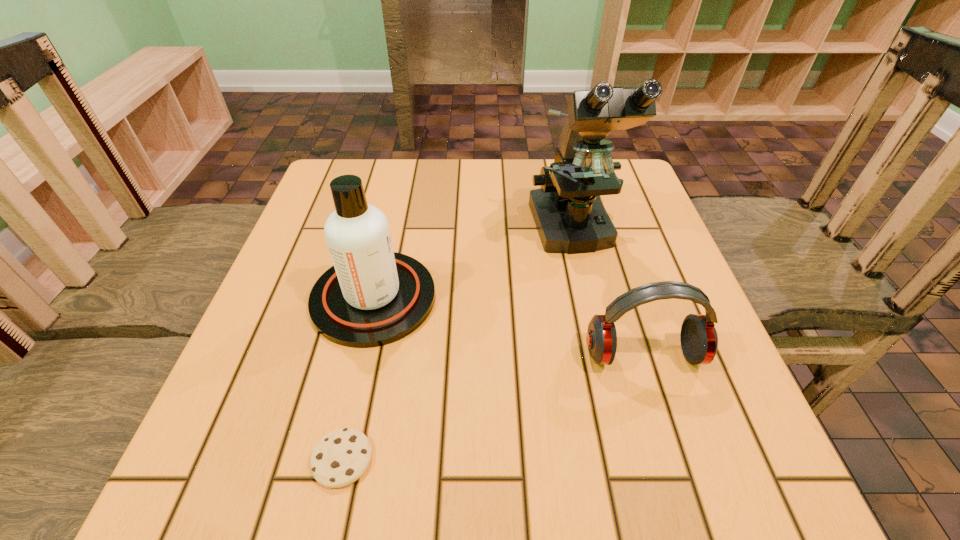
At what (x,y) coordinates should I click in order to perform the action: click on microscope. Please return your answer as a coordinate pair (x, y). The width and height of the screenshot is (960, 540). Looking at the image, I should click on (570, 218).

Image resolution: width=960 pixels, height=540 pixels. I want to click on the second tallest object, so click(372, 296).

At what (x,y) coordinates should I click in order to perform the action: click on the second shortest object. Please return your answer as a coordinate pair (x, y). Looking at the image, I should click on 699,341.

Locate an element on the screen. This screenshot has width=960, height=540. the nearest object is located at coordinates (341, 457).

Find the location of a particular element. This screenshot has height=540, width=960. the shortest object is located at coordinates (341, 457).

The height and width of the screenshot is (540, 960). I want to click on blank area located 0.290m on the left of the tallest object, so click(404, 231).

The width and height of the screenshot is (960, 540). Find the location of `free spot located 0.240m on the front of the third shortest object`. free spot located 0.240m on the front of the third shortest object is located at coordinates (329, 492).

You are a GUI agent. You are given a task and a screenshot of the screen. Output one action in this format:
    pyautogui.click(x=<x>, y=<y>)
    Task: Click on the free space located on the ear cups of the second shortest object
    The width and height of the screenshot is (960, 540).
    Given the screenshot: What is the action you would take?
    pyautogui.click(x=677, y=459)

I want to click on vacant area located 0.070m on the back of the shortest object, so click(x=357, y=390).

Identify the location of object that is at the far edge. This screenshot has width=960, height=540. (570, 218).